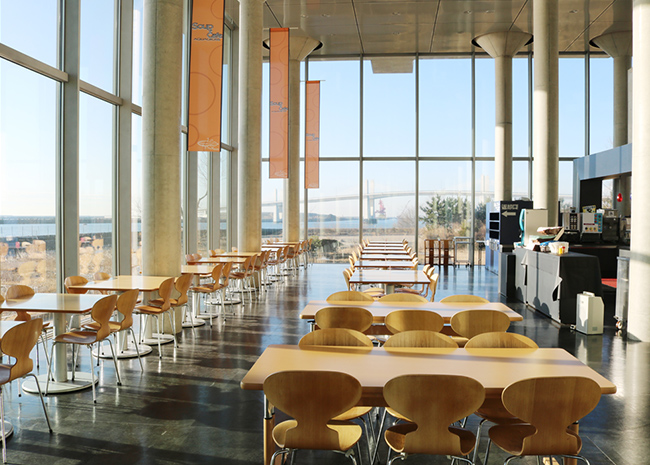
At what (x,y) coordinates should I click in order to perform the action: click on pillars. Please return your answer as a coordinate pair (x, y). This screenshot has width=650, height=465. Looking at the image, I should click on pos(160,173), pos(252,184), pos(292,201), pos(504,146), pos(545,143), pos(621,88).